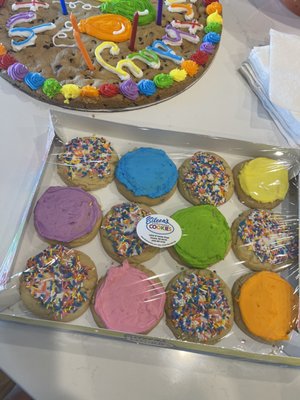
Where is `individual napkins`? This screenshot has height=400, width=300. individual napkins is located at coordinates tap(274, 46), tap(255, 49), tap(251, 51), tap(250, 54), tap(250, 58), tap(246, 63), tap(246, 69).